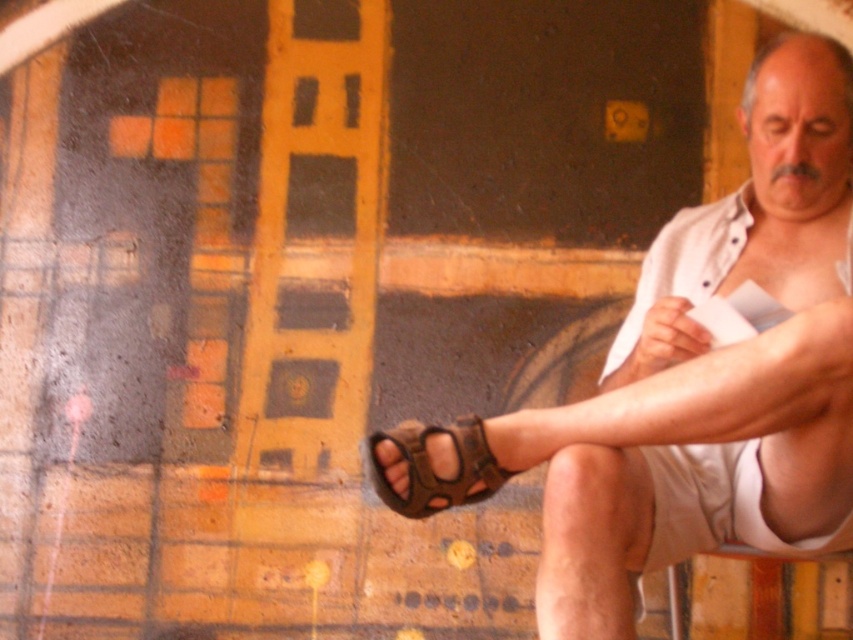
Question: Which point is closer to the camera?

Choices:
 (A) brown leather sandals at lower left
 (B) brown leather sandal at lower right

Answer: (A)

Question: Can you confirm if brown leather sandals at lower left is positioned to the left of brown leather sandal at lower right?

Choices:
 (A) no
 (B) yes

Answer: (A)

Question: Is brown leather sandals at lower left positioned before brown leather sandal at lower right?

Choices:
 (A) no
 (B) yes

Answer: (B)

Question: Does brown leather sandals at lower left appear over brown leather sandal at lower right?

Choices:
 (A) yes
 (B) no

Answer: (A)

Question: Which point appears closest to the camera in this image?

Choices:
 (A) (631, 497)
 (B) (374, 435)

Answer: (B)